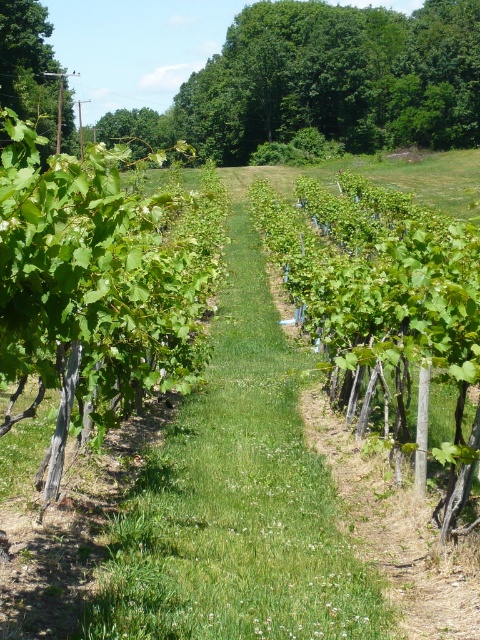
You are standing in the vineyard and see two points marked in the scene. Which point is closer to you, point (273, 76) or point (48, 150)?

Point (48, 150) is closer to you because it is less further to the viewer than point (273, 76) according to the description.

You are a landscape architect designing a new vineyard layout. You want to place a new grapevine row between the green leafy tree at upper center and the green leafy tree at upper left. Which tree should you use as a reference point for the row alignment to ensure the row is closer to the shorter tree?

The green leafy tree at upper center is shorter than the green leafy tree at upper left. Therefore, to align the new grapevine row closer to the shorter tree, you should use the green leafy tree at upper center as the reference point.

You are a landscape architect planning to add a new pathway between the green leafy tree at upper center and the green leafy tree at upper left. Based on their widths, which tree would require more space to accommodate its spread when designing the pathway?

The green leafy tree at upper center has a greater width than the green leafy tree at upper left, so it would require more space to accommodate its spread when designing the pathway.